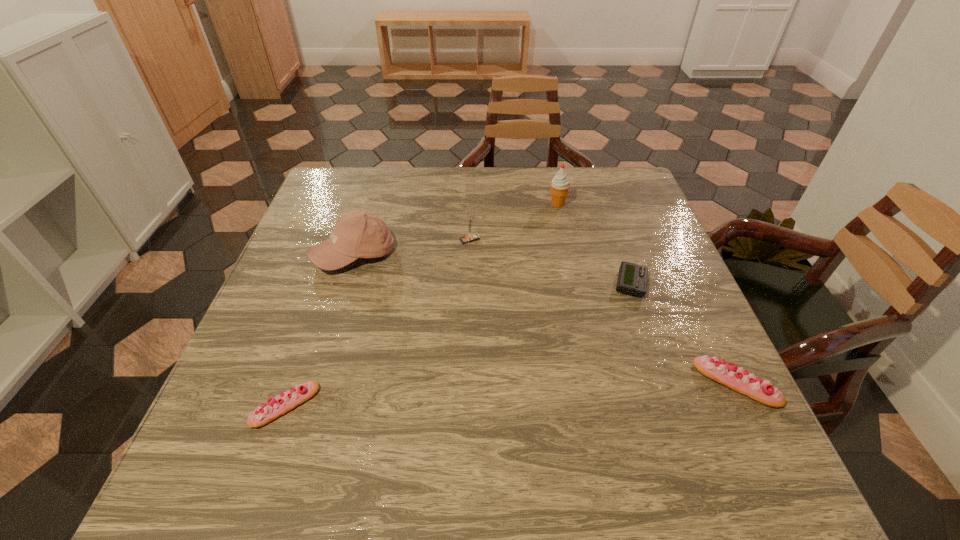
If we want them evenly spaced by inserting an extra eclair among them, please locate a free spot for this new eclair. Please provide its 2D coordinates. Your answer should be formatted as a tuple, i.e. [(x, y)], where the tuple contains the x and y coordinates of a point satisfying the conditions above.

[(516, 394)]